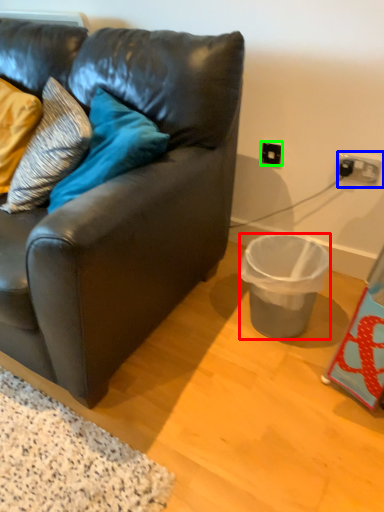
Question: Which object is the farthest from trash bin/can (highlighted by a red box)? Choose among these: power outlet (highlighted by a blue box) or electric outlet (highlighted by a green box).

Choices:
 (A) power outlet
 (B) electric outlet

Answer: (B)